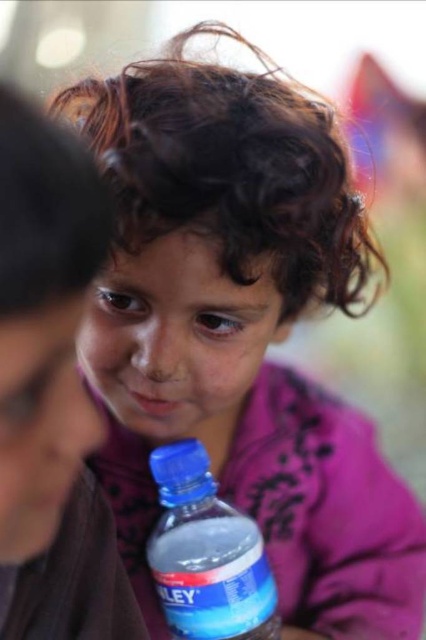
You are a photographer who wants to ensure both the matte plastic bottle at lower center and the blue plastic bottle at lower center are fully visible in the photo. Given their heights, which bottle might require adjusting its position to prevent being hidden by the other?

The matte plastic bottle at lower center is taller than the blue plastic bottle at lower center, so adjusting the position of the blue plastic bottle at lower center might be necessary to ensure it isn

You are a photographer adjusting the focus on your camera. You notice the point at coordinates [51,392] in the image. Based on the scene description, what object is this point likely part of?

The point at coordinates [51,392] is on the matte plastic bottle at lower center.

You are a photographer adjusting the focus on your camera. You have two points in your viewfinder, point (81, 387) and point (261, 580). Which point is closer to you?

Point (81, 387) is closer to the viewer than point (261, 580).